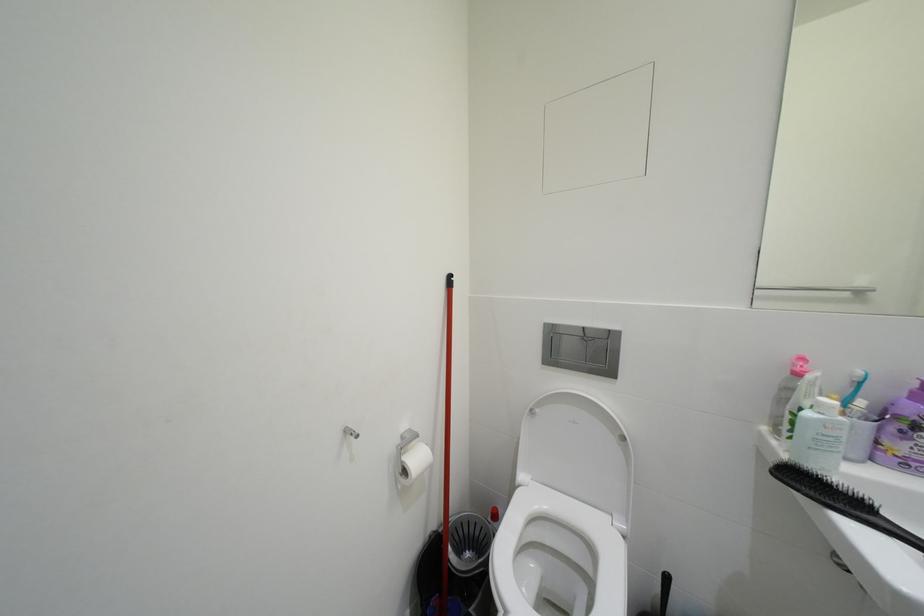
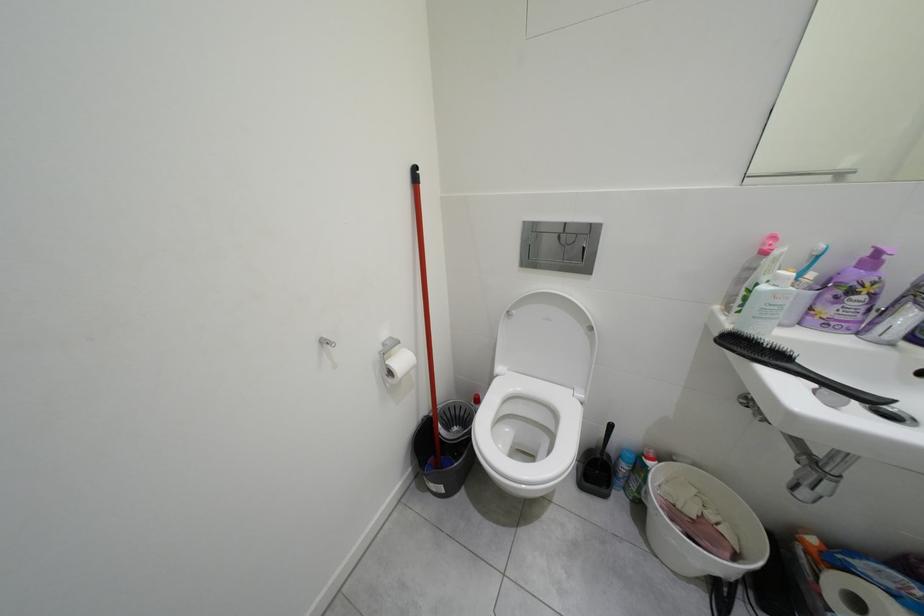
Which direction would the cameraman need to move to produce the second image?

The movement direction of the cameraman is right, forward.